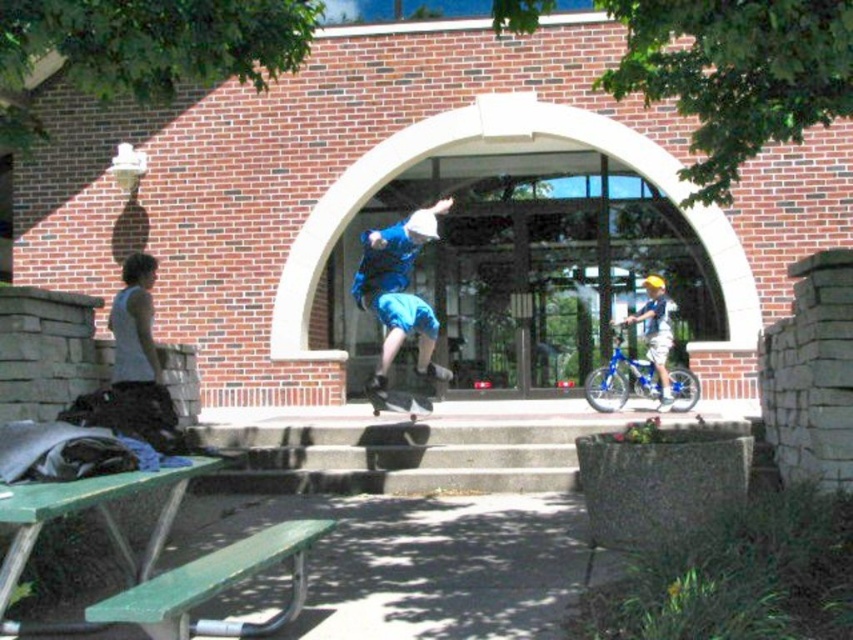
Question: Can you confirm if green plastic picnic table at lower left is positioned above blue denim shorts at center?

Choices:
 (A) yes
 (B) no

Answer: (B)

Question: Which of the following is the farthest from the observer?

Choices:
 (A) green painted wood park bench at lower left
 (B) blue metallic bicycle at right

Answer: (B)

Question: Which object is positioned closest to the green plastic picnic table at lower left?

Choices:
 (A) blue denim shorts at center
 (B) light blue denim shorts at right
 (C) black smooth skateboard at center
 (D) green painted wood park bench at lower left

Answer: (D)

Question: Estimate the real-world distances between objects in this image. Which object is closer to the black smooth skateboard at center?

Choices:
 (A) blue denim shorts at center
 (B) blue metallic bicycle at right
 (C) green plastic picnic table at lower left
 (D) light blue denim shorts at right

Answer: (A)

Question: From the image, what is the correct spatial relationship of light blue denim shorts at right in relation to black smooth skateboard at center?

Choices:
 (A) right
 (B) left

Answer: (A)

Question: Considering the relative positions of green plastic picnic table at lower left and black smooth skateboard at center in the image provided, where is green plastic picnic table at lower left located with respect to black smooth skateboard at center?

Choices:
 (A) below
 (B) above

Answer: (B)